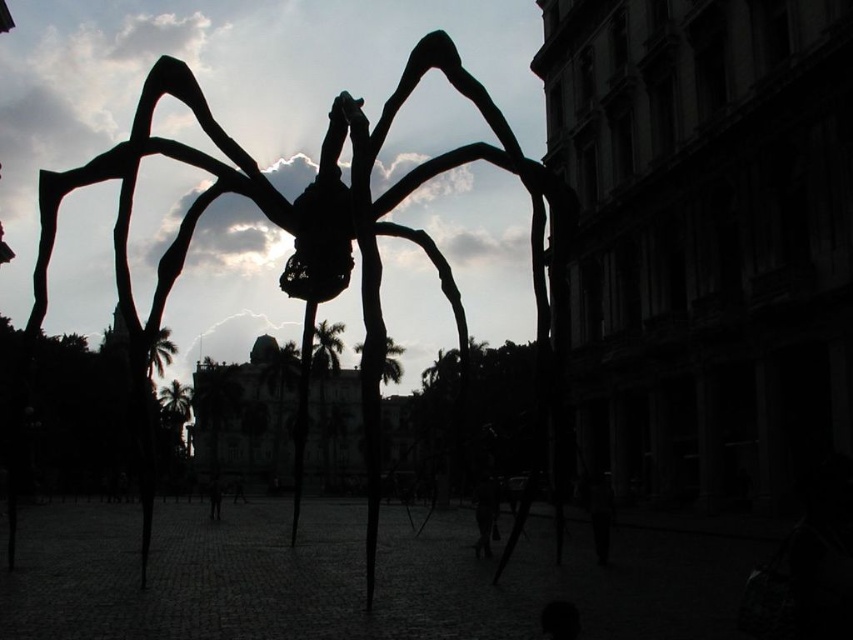
Is silhouette metal spider at center to the right of dark skin human at center from the viewer's perspective?

Indeed, silhouette metal spider at center is positioned on the right side of dark skin human at center.

Where is `silhouette metal spider at center`? silhouette metal spider at center is located at coordinates (323, 259).

Find the location of `silhouette metal spider at center`. silhouette metal spider at center is located at coordinates (323, 259).

Is silhouette metal spider at center wider than dark fabric bag at center?

Yes.

Which of these two, silhouette metal spider at center or dark fabric bag at center, stands shorter?

Standing shorter between the two is dark fabric bag at center.

This screenshot has width=853, height=640. Describe the element at coordinates (323, 259) in the screenshot. I see `silhouette metal spider at center` at that location.

You are a GUI agent. You are given a task and a screenshot of the screen. Output one action in this format:
    pyautogui.click(x=<x>, y=<y>)
    Task: Click on the silhouette metal spider at center
    
    Given the screenshot: What is the action you would take?
    pyautogui.click(x=323, y=259)

Which is below, dark fabric bag at center or dark skin human at center?

dark skin human at center is lower down.

Is point (480, 486) positioned behind point (213, 483)?

That is False.

Who is more distant from viewer, [474,547] or [210,488]?

Point [210,488]

The width and height of the screenshot is (853, 640). I want to click on dark fabric bag at center, so (485, 513).